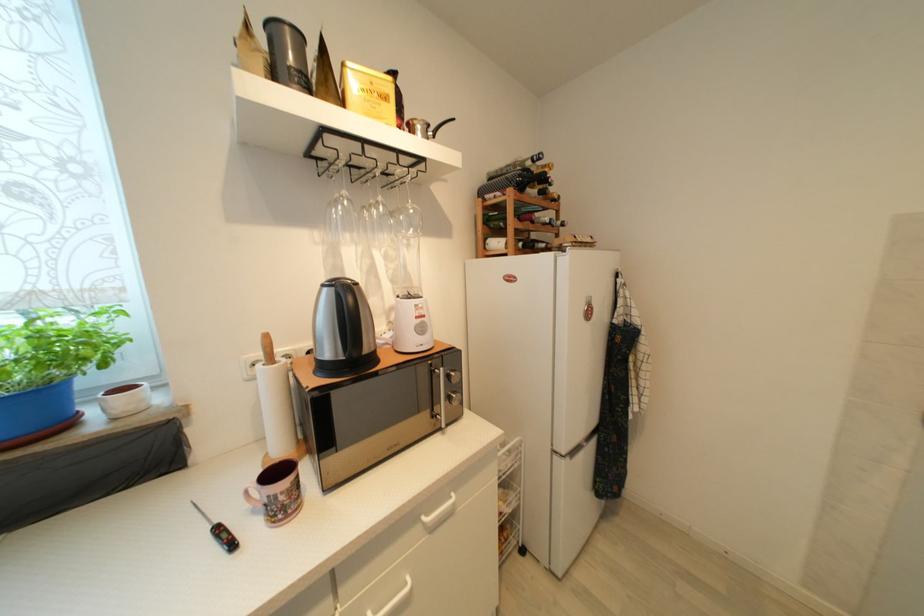
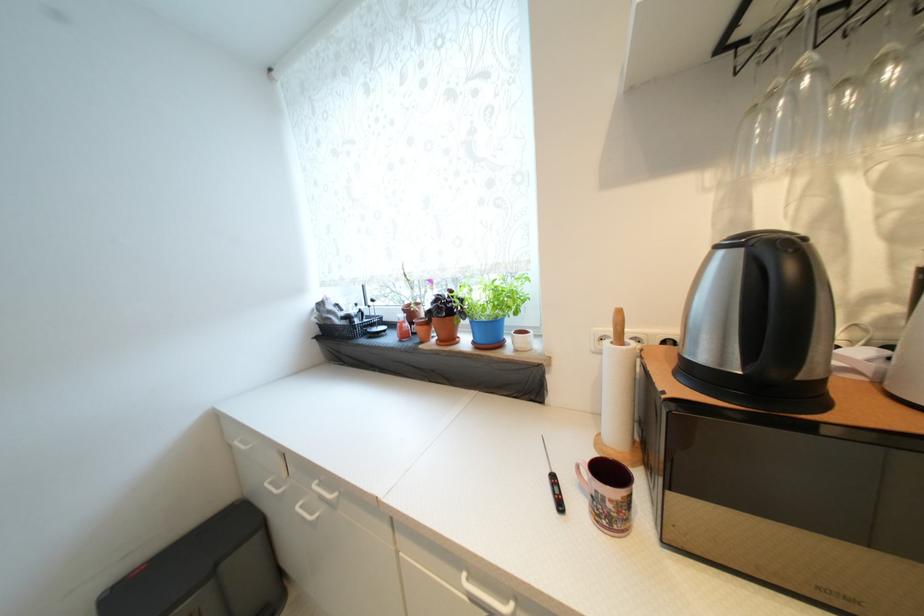
Question: I am providing you with two images of the same scene from different viewpoints. Please identify which objects are invisible in image2.

Choices:
 (A) small brown pot
 (B) white ceramic cup
 (C) black kettle handle
 (D) none of these

Answer: (D)